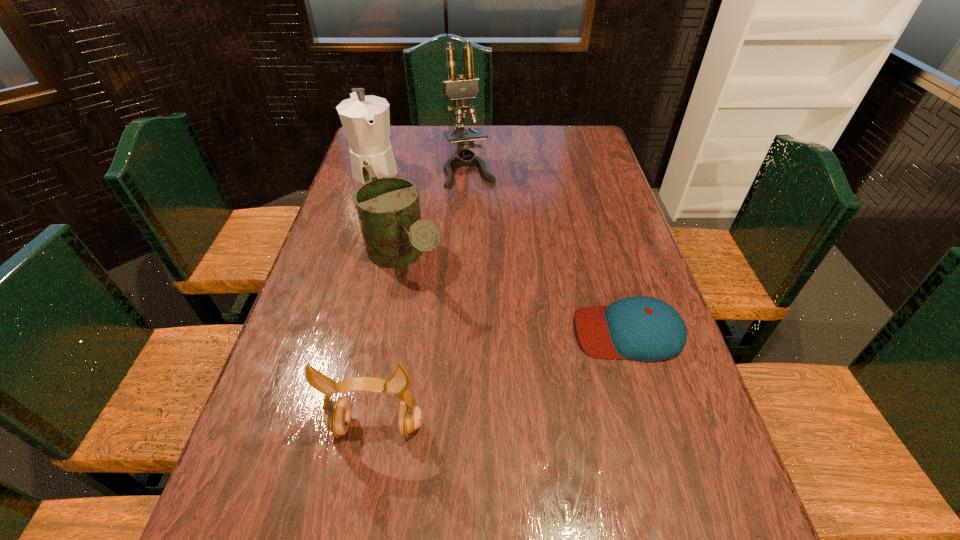
I want to click on free spot that satisfies the following two spatial constraints: 1. on the front side of the baseball cap; 2. with the bill of the second tallest object facing forward, so click(x=325, y=332).

The width and height of the screenshot is (960, 540). I want to click on free space that satisfies the following two spatial constraints: 1. on the front side of the baseball cap; 2. with the bill of the tallest object facing forward, so click(x=465, y=332).

Locate an element on the screen. The image size is (960, 540). free point that satisfies the following two spatial constraints: 1. on the front side of the coffeepot; 2. with the bill of the shortest object facing forward is located at coordinates (325, 332).